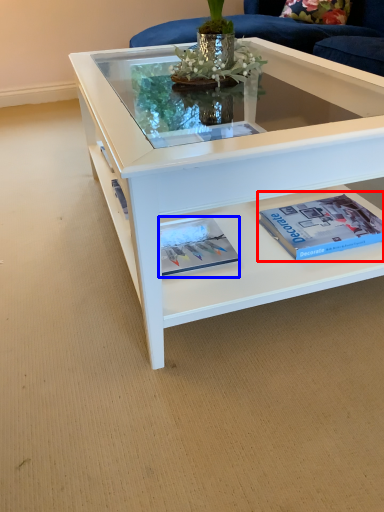
Question: Which of the following is the farthest to the observer, paperback book (highlighted by a red box) or magazine (highlighted by a blue box)?

Choices:
 (A) paperback book
 (B) magazine

Answer: (A)